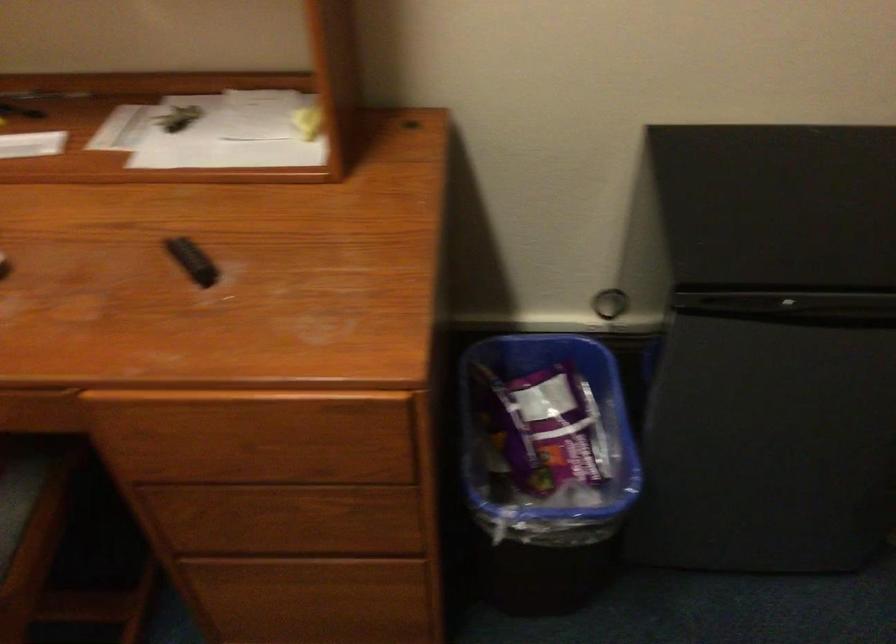
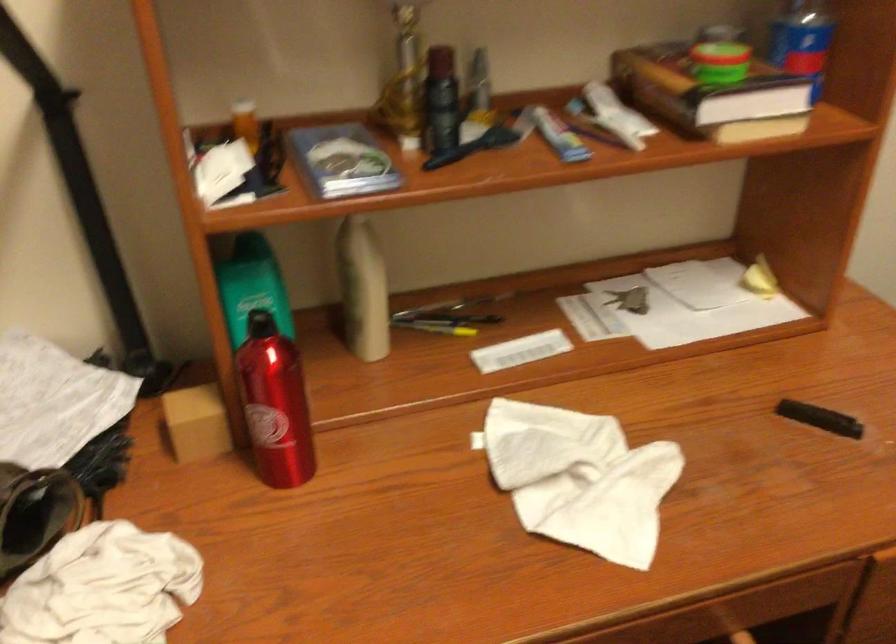
Question: The images are taken continuously from a first-person perspective. In which direction are you moving?

Choices:
 (A) Left
 (B) Right
 (C) Forward
 (D) Backward

Answer: (A)